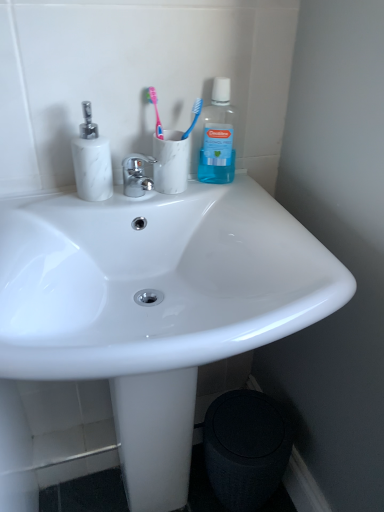
Question: Is transparent plastic mouthwash at upper right positioned with its back to white marble soap dispenser at left?

Choices:
 (A) yes
 (B) no

Answer: (B)

Question: Is transparent plastic mouthwash at upper right thinner than white marble soap dispenser at left?

Choices:
 (A) no
 (B) yes

Answer: (B)

Question: From the image's perspective, is transparent plastic mouthwash at upper right on top of white marble soap dispenser at left?

Choices:
 (A) yes
 (B) no

Answer: (A)

Question: Does transparent plastic mouthwash at upper right contain white marble soap dispenser at left?

Choices:
 (A) yes
 (B) no

Answer: (B)

Question: Considering the relative sizes of transparent plastic mouthwash at upper right and white marble soap dispenser at left in the image provided, is transparent plastic mouthwash at upper right smaller than white marble soap dispenser at left?

Choices:
 (A) no
 (B) yes

Answer: (B)

Question: Is transparent plastic mouthwash at upper right wider or thinner than pink plastic toothbrush at upper center, which is the 1th toothbrush in left-to-right order?

Choices:
 (A) wide
 (B) thin

Answer: (A)

Question: Visually, is transparent plastic mouthwash at upper right positioned to the left or to the right of pink plastic toothbrush at upper center, which is the 1th toothbrush in left-to-right order?

Choices:
 (A) right
 (B) left

Answer: (A)

Question: From a real-world perspective, is transparent plastic mouthwash at upper right positioned above or below pink plastic toothbrush at upper center, which is the 1th toothbrush in left-to-right order?

Choices:
 (A) below
 (B) above

Answer: (A)

Question: Is transparent plastic mouthwash at upper right spatially inside pink plastic toothbrush at upper center, which is the 1th toothbrush in left-to-right order, or outside of it?

Choices:
 (A) outside
 (B) inside

Answer: (A)

Question: From a real-world perspective, relative to blue translucent toothbrush at upper center, the 1th toothbrush from the right, is white marble toothbrush holder at upper center vertically above or below?

Choices:
 (A) above
 (B) below

Answer: (B)

Question: From the image's perspective, is white marble toothbrush holder at upper center positioned above or below blue translucent toothbrush at upper center, the 1th toothbrush from the right?

Choices:
 (A) above
 (B) below

Answer: (B)

Question: In the image, is white marble toothbrush holder at upper center positioned in front of or behind blue translucent toothbrush at upper center, marked as the second toothbrush in a left-to-right arrangement?

Choices:
 (A) behind
 (B) front

Answer: (B)

Question: Is white marble toothbrush holder at upper center situated inside blue translucent toothbrush at upper center, the 1th toothbrush from the right, or outside?

Choices:
 (A) inside
 (B) outside

Answer: (B)

Question: Would you say white glossy sink at center is inside or outside white marble soap dispenser at left?

Choices:
 (A) inside
 (B) outside

Answer: (B)

Question: Is point (157, 437) closer or farther from the camera than point (84, 102)?

Choices:
 (A) closer
 (B) farther

Answer: (B)